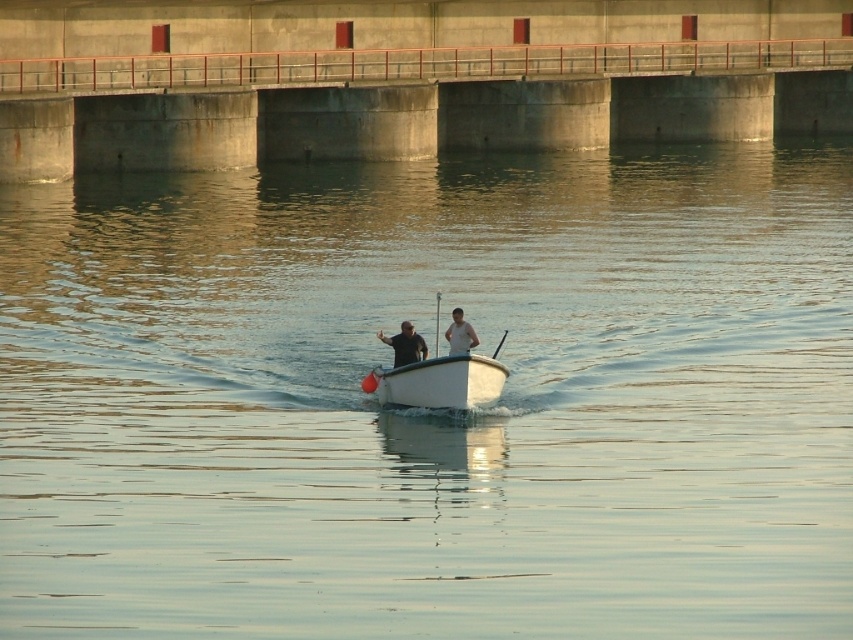
Does white plastic boat at center have a larger size compared to black matte shirt at center?

Yes.

Who is taller, white plastic boat at center or black matte shirt at center?

Standing taller between the two is white plastic boat at center.

Is point (466, 342) in front of point (404, 362)?

Yes, point (466, 342) is in front of point (404, 362).

This screenshot has width=853, height=640. I want to click on white plastic boat at center, so click(x=438, y=371).

Can you confirm if black matte shirt at center is taller than white matte shirt at center?

Indeed, black matte shirt at center has a greater height compared to white matte shirt at center.

Can you confirm if black matte shirt at center is smaller than white matte shirt at center?

Incorrect, black matte shirt at center is not smaller in size than white matte shirt at center.

Identify the location of black matte shirt at center. pyautogui.click(x=405, y=344).

Is white plastic boat at center to the left of white matte shirt at center from the viewer's perspective?

Yes, white plastic boat at center is to the left of white matte shirt at center.

Can you confirm if white plastic boat at center is shorter than white matte shirt at center?

No, white plastic boat at center is not shorter than white matte shirt at center.

Is point (425, 378) more distant than point (457, 346)?

No, (425, 378) is closer to viewer.

You are a GUI agent. You are given a task and a screenshot of the screen. Output one action in this format:
    pyautogui.click(x=<x>, y=<y>)
    Task: Click on the white plastic boat at center
    This screenshot has width=853, height=640.
    Given the screenshot: What is the action you would take?
    pyautogui.click(x=438, y=371)